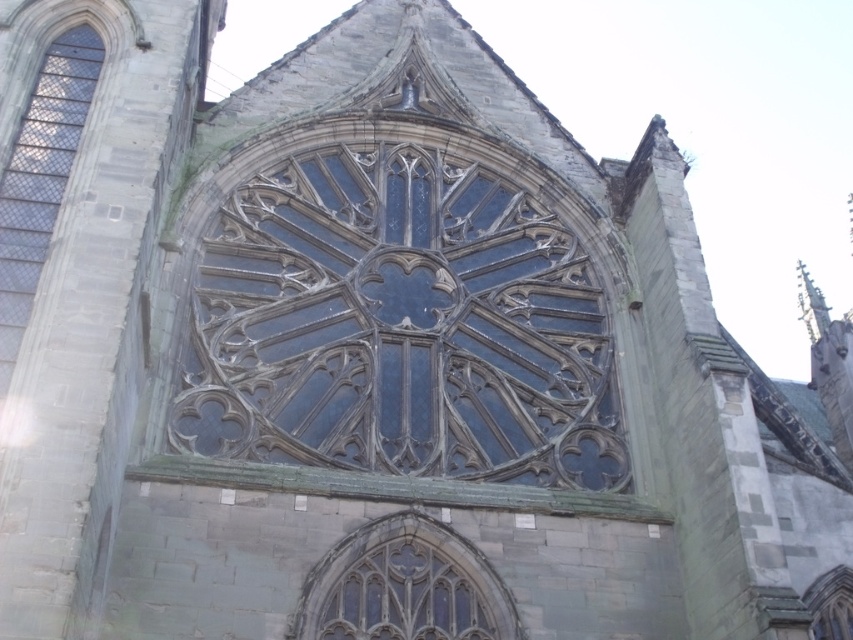
Question: Which object is positioned farthest from the clear glass window at center?

Choices:
 (A) dark glass window at center
 (B) dark glass window at left

Answer: (B)

Question: Is dark glass window at left further to camera compared to clear glass window at center?

Choices:
 (A) yes
 (B) no

Answer: (B)

Question: Which point is closer to the camera taking this photo?

Choices:
 (A) (438, 211)
 (B) (421, 604)
 (C) (86, 33)

Answer: (B)

Question: Which of these objects is positioned closest to the clear glass window at center?

Choices:
 (A) dark glass window at left
 (B) dark glass window at center

Answer: (B)

Question: Does dark glass window at left appear over clear glass window at center?

Choices:
 (A) yes
 (B) no

Answer: (A)

Question: Considering the relative positions of dark glass window at left and clear glass window at center in the image provided, where is dark glass window at left located with respect to clear glass window at center?

Choices:
 (A) left
 (B) right

Answer: (A)